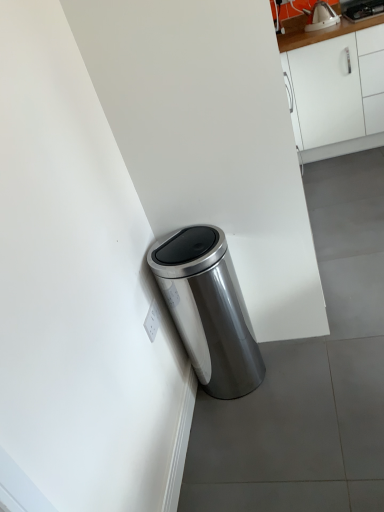
Question: Does white matte cabinet at upper right come behind satin silver trash can at lower left?

Choices:
 (A) yes
 (B) no

Answer: (A)

Question: Is white matte cabinet at upper right placed right next to satin silver trash can at lower left?

Choices:
 (A) yes
 (B) no

Answer: (B)

Question: Is white matte cabinet at upper right far from satin silver trash can at lower left?

Choices:
 (A) no
 (B) yes

Answer: (B)

Question: Considering the relative sizes of white matte cabinet at upper right and satin silver trash can at lower left in the image provided, is white matte cabinet at upper right bigger than satin silver trash can at lower left?

Choices:
 (A) no
 (B) yes

Answer: (B)

Question: Is white matte cabinet at upper right positioned before satin silver trash can at lower left?

Choices:
 (A) yes
 (B) no

Answer: (B)

Question: Considering the relative sizes of white matte cabinet at upper right and satin silver trash can at lower left in the image provided, is white matte cabinet at upper right taller than satin silver trash can at lower left?

Choices:
 (A) yes
 (B) no

Answer: (A)

Question: Is satin silver trash can at lower left at the right side of white matte cabinet at upper right?

Choices:
 (A) yes
 (B) no

Answer: (B)

Question: Does satin silver trash can at lower left come behind white matte cabinet at upper right?

Choices:
 (A) no
 (B) yes

Answer: (A)

Question: From a real-world perspective, is satin silver trash can at lower left physically below white matte cabinet at upper right?

Choices:
 (A) yes
 (B) no

Answer: (A)

Question: From the image's perspective, is satin silver trash can at lower left under white matte cabinet at upper right?

Choices:
 (A) yes
 (B) no

Answer: (A)

Question: Is satin silver trash can at lower left thinner than white matte cabinet at upper right?

Choices:
 (A) no
 (B) yes

Answer: (B)

Question: Is satin silver trash can at lower left smaller than white matte cabinet at upper right?

Choices:
 (A) no
 (B) yes

Answer: (B)

Question: Is satin silver trash can at lower left smaller than metallic silver kettle at upper right?

Choices:
 (A) no
 (B) yes

Answer: (A)